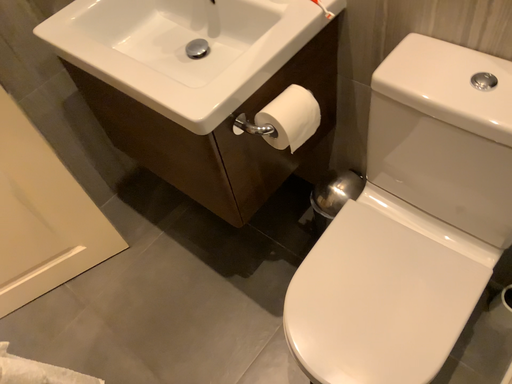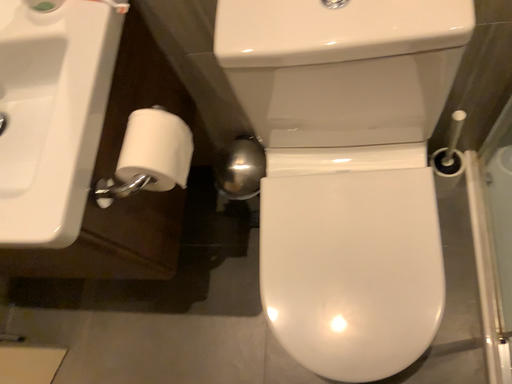
Question: Which way did the camera rotate in the video?

Choices:
 (A) rotated left
 (B) rotated right

Answer: (B)